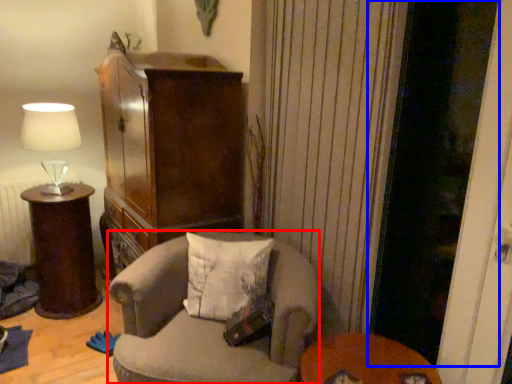
Question: Which object is further to the camera taking this photo, chair (highlighted by a red box) or screen door (highlighted by a blue box)?

Choices:
 (A) chair
 (B) screen door

Answer: (A)